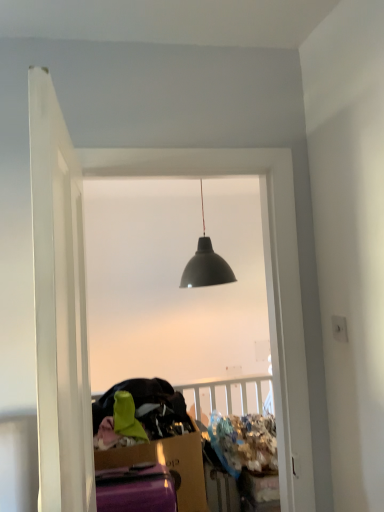
The width and height of the screenshot is (384, 512). What do you see at coordinates (174, 283) in the screenshot?
I see `matte black lampshade at center` at bounding box center [174, 283].

Identify the location of matte black lampshade at center. This screenshot has height=512, width=384. (174, 283).

Measure the distance between white smooth door at left and camera.

white smooth door at left is 29.01 inches away from camera.

The image size is (384, 512). What do you see at coordinates (59, 307) in the screenshot?
I see `white smooth door at left` at bounding box center [59, 307].

Identify the location of white smooth door at left. (59, 307).

This screenshot has height=512, width=384. In order to click on matte black lampshade at center in this screenshot , I will do `click(174, 283)`.

Is matte black lampshade at center at the right side of white smooth door at left?

Yes.

Is matte black lampshade at center positioned before white smooth door at left?

That is False.

Is point (254, 187) positioned before point (51, 217)?

No.

From the image's perspective, does matte black lampshade at center appear higher than white smooth door at left?

Actually, matte black lampshade at center appears below white smooth door at left in the image.

From a real-world perspective, who is located higher, matte black lampshade at center or white smooth door at left?

white smooth door at left.

Between matte black lampshade at center and white smooth door at left, which one has smaller width?

matte black lampshade at center.

Consider the image. Is matte black lampshade at center taller than white smooth door at left?

Correct, matte black lampshade at center is much taller as white smooth door at left.

In the scene shown: Which of these two, matte black lampshade at center or white smooth door at left, is smaller?

Smaller between the two is matte black lampshade at center.

Is matte black lampshade at center not within white smooth door at left?

matte black lampshade at center lies outside white smooth door at left's area.

Is matte black lampshade at center not near white smooth door at left?

matte black lampshade at center is positioned a significant distance from white smooth door at left.

Is matte black lampshade at center oriented away from white smooth door at left?

That's not correct — matte black lampshade at center is not looking away from white smooth door at left.

How different are the orientations of matte black lampshade at center and white smooth door at left in degrees?

The angle between the facing direction of matte black lampshade at center and the facing direction of white smooth door at left is 95 degrees.

Measure the distance between matte black lampshade at center and white smooth door at left.

matte black lampshade at center is 11.25 feet away from white smooth door at left.

Image resolution: width=384 pixels, height=512 pixels. Identify the location of door on the left of matte black lampshade at center. (59, 307).

Which object is positioned more to the right, white smooth door at left or matte black lampshade at center?

matte black lampshade at center.

In the scene shown: Is the depth of white smooth door at left greater than that of matte black lampshade at center?

No, the depth of white smooth door at left is less than that of matte black lampshade at center.

Is point (29, 73) closer or farther from the camera than point (136, 329)?

Clearly, point (29, 73) is closer to the camera than point (136, 329).

From the image's perspective, is white smooth door at left beneath matte black lampshade at center?

No, from the image's perspective, white smooth door at left is not below matte black lampshade at center.

From a real-world perspective, which is physically above, white smooth door at left or matte black lampshade at center?

white smooth door at left.

From the picture: Is white smooth door at left wider or thinner than matte black lampshade at center?

Clearly, white smooth door at left has more width compared to matte black lampshade at center.

Is white smooth door at left taller than matte black lampshade at center?

No, white smooth door at left is not taller than matte black lampshade at center.

Is white smooth door at left bigger than matte black lampshade at center?

Yes, white smooth door at left is bigger than matte black lampshade at center.

Is white smooth door at left inside the boundaries of matte black lampshade at center, or outside?

white smooth door at left is not inside matte black lampshade at center, it's outside.

Is white smooth door at left far from matte black lampshade at center?

Yes.

Is white smooth door at left oriented towards matte black lampshade at center?

Yes, white smooth door at left is turned towards matte black lampshade at center.

I want to click on door in front of the matte black lampshade at center, so (x=59, y=307).

Image resolution: width=384 pixels, height=512 pixels. I want to click on window on the right of the white smooth door at left, so click(x=174, y=283).

Image resolution: width=384 pixels, height=512 pixels. What are the coordinates of `door located above the matte black lampshade at center (from a real-world perspective)` in the screenshot? It's located at (59, 307).